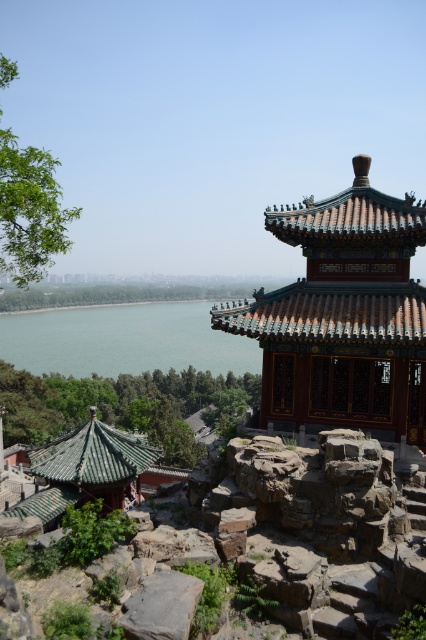
Question: Which object is farther from the camera taking this photo?

Choices:
 (A) gray rough rock at center
 (B) green water at lower left

Answer: (B)

Question: Can you confirm if green water at lower left is bigger than gray rough rock at center?

Choices:
 (A) yes
 (B) no

Answer: (A)

Question: Estimate the real-world distances between objects in this image. Which object is closer to the green water at lower left?

Choices:
 (A) gray rough rock at center
 (B) shiny dark green gazebo at upper right

Answer: (B)

Question: Where is green water at lower left located in relation to gray rough rock at center in the image?

Choices:
 (A) below
 (B) above

Answer: (B)

Question: Is shiny dark green gazebo at upper right further to camera compared to green water at lower left?

Choices:
 (A) no
 (B) yes

Answer: (A)

Question: Which is nearer to the gray rough rock at center?

Choices:
 (A) shiny dark green gazebo at upper right
 (B) green water at lower left

Answer: (A)